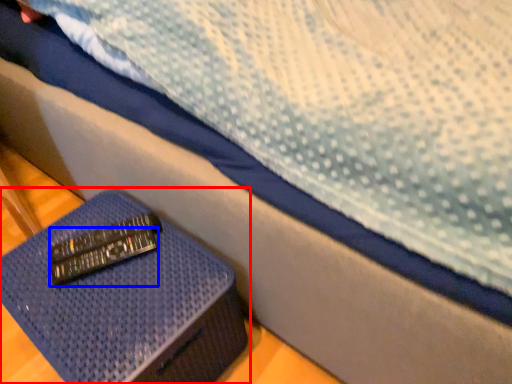
Question: Which object is closer to the camera taking this photo, furniture (highlighted by a red box) or remote (highlighted by a blue box)?

Choices:
 (A) furniture
 (B) remote

Answer: (A)